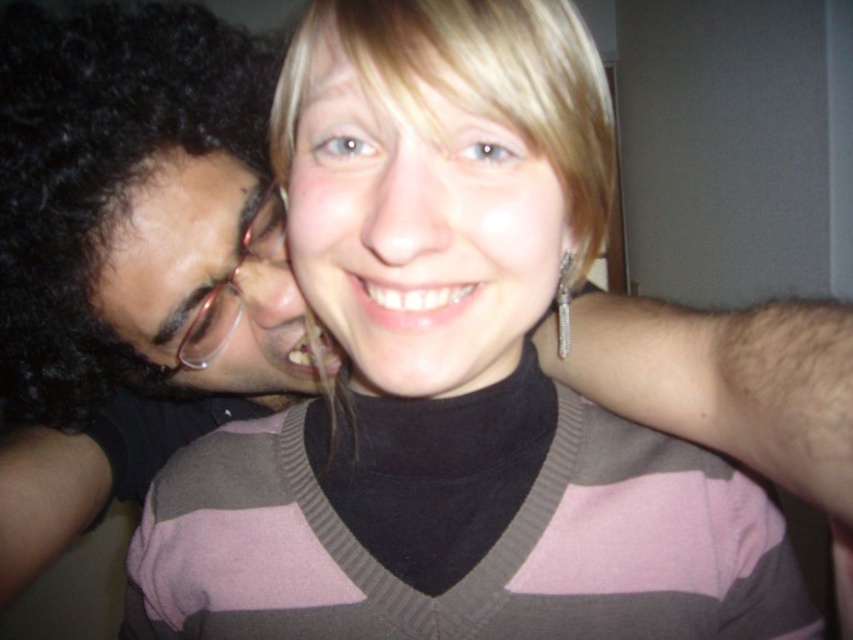
Question: Does blonde hair at center have a greater width compared to matte black glasses at left?

Choices:
 (A) yes
 (B) no

Answer: (B)

Question: Is matte black hair at left wider than blonde hair at center?

Choices:
 (A) no
 (B) yes

Answer: (B)

Question: Which object is the farthest from the matte black hair at left?

Choices:
 (A) matte black glasses at left
 (B) blonde hair at center

Answer: (B)

Question: In this image, where is matte black hair at left located relative to blonde hair at center?

Choices:
 (A) above
 (B) below

Answer: (B)

Question: Which object is the closest to the matte black glasses at left?

Choices:
 (A) matte black hair at left
 (B) blonde hair at center

Answer: (A)

Question: Among these points, which one is farthest from the camera?

Choices:
 (A) (102, 49)
 (B) (415, 125)

Answer: (A)